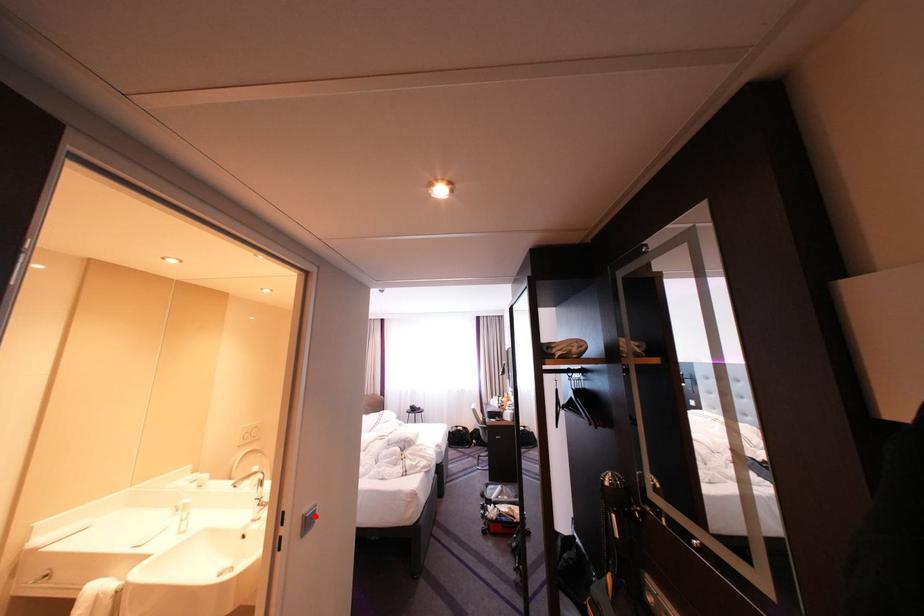
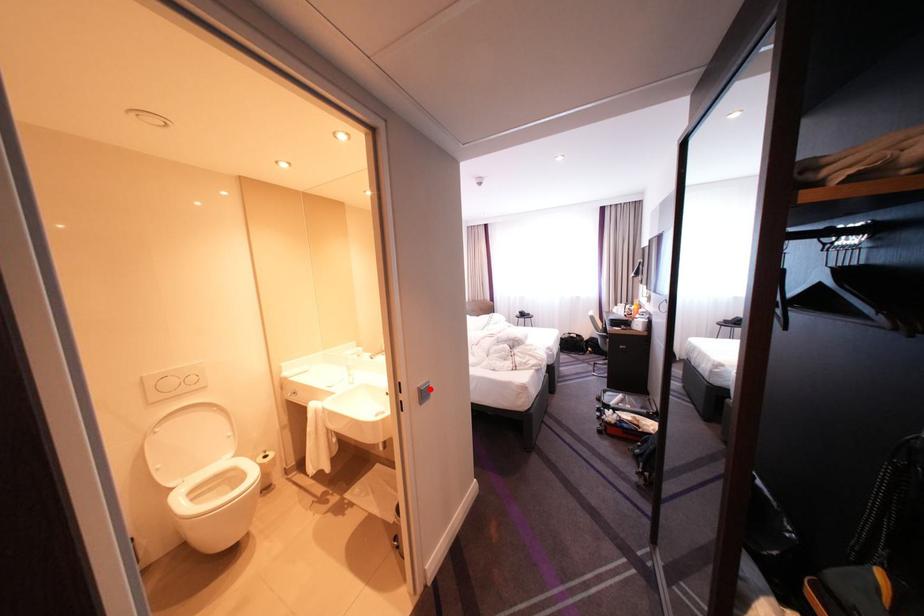
I am providing you with two images of the same scene from different viewpoints. A red point is marked on the first image and another point is marked on the second image. Do the highlighted points in image1 and image2 indicate the same real-world spot?

Yes